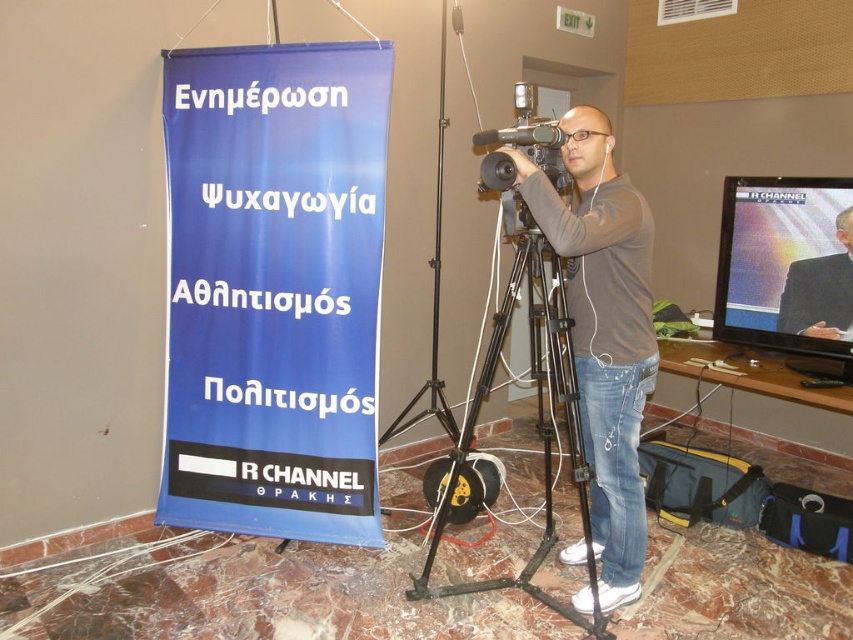
Question: Which object appears farthest from the camera in this image?

Choices:
 (A) dark gray suit at upper right
 (B) black metal tripod at center
 (C) matte black video camera at center

Answer: (A)

Question: Does matte brown shirt at center have a greater width compared to dark gray suit at upper right?

Choices:
 (A) no
 (B) yes

Answer: (B)

Question: Which point appears closest to the camera in this image?

Choices:
 (A) (515, 102)
 (B) (508, 323)

Answer: (A)

Question: Is black metal tripod at center wider than matte black video camera at center?

Choices:
 (A) no
 (B) yes

Answer: (B)

Question: Which of these objects is positioned farthest from the black metal tripod at center?

Choices:
 (A) matte brown shirt at center
 (B) matte black video camera at center

Answer: (B)

Question: Is matte brown shirt at center in front of black metal tripod at center?

Choices:
 (A) yes
 (B) no

Answer: (A)